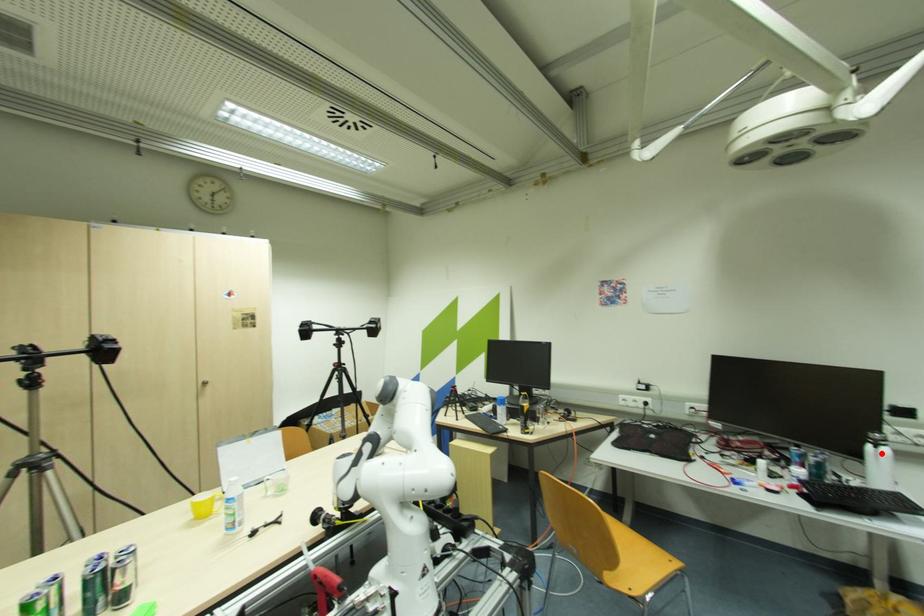
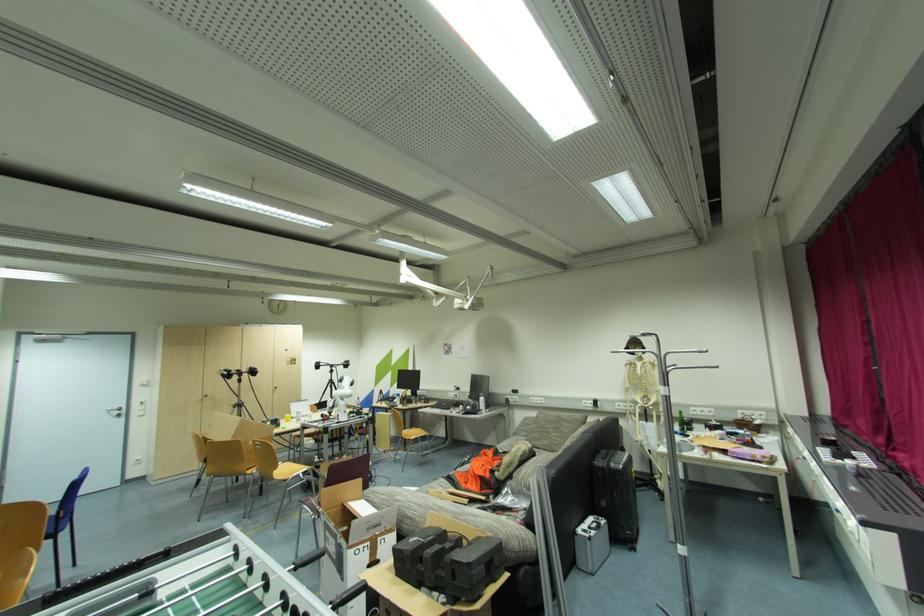
Where in the second image is the point corresponding to the highlighted location from the first image?

(484, 400)